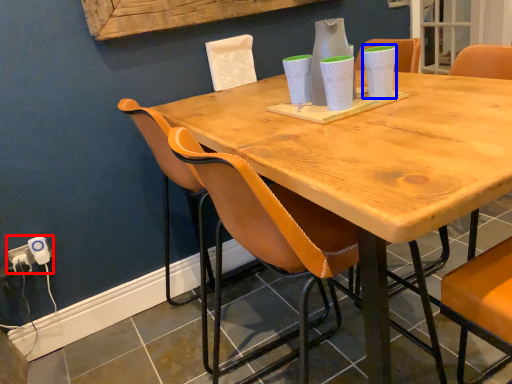
Question: Among these objects, which one is farthest to the camera, electric outlet (highlighted by a red box) or vase (highlighted by a blue box)?

Choices:
 (A) electric outlet
 (B) vase

Answer: (A)